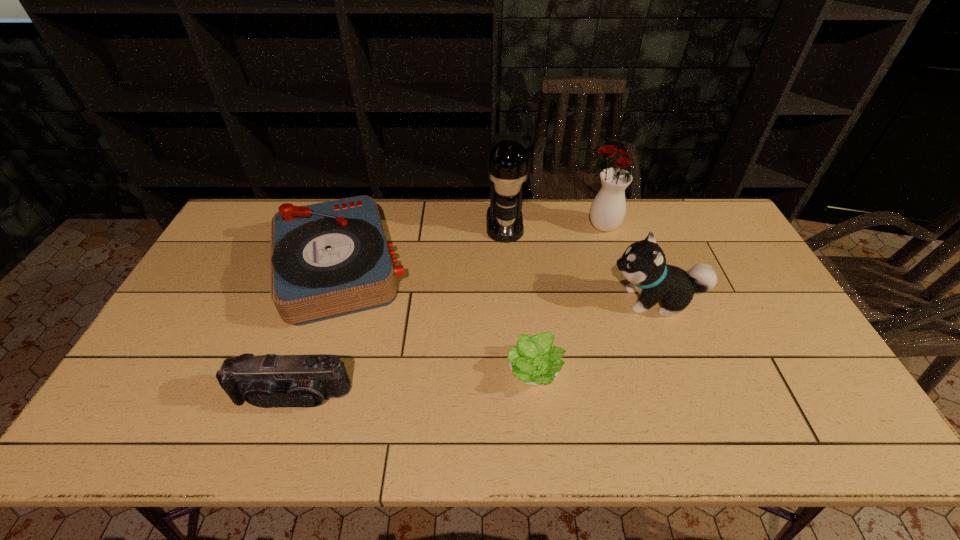
Find the location of a particular element. This screenshot has width=960, height=540. coffee maker is located at coordinates (508, 161).

The height and width of the screenshot is (540, 960). I want to click on vase, so click(x=608, y=208).

Find the location of `puppy`. puppy is located at coordinates (643, 263).

At what (x,y) coordinates should I click in order to perform the action: click on record player. Please return your answer as a coordinate pair (x, y). The width and height of the screenshot is (960, 540). Looking at the image, I should click on (331, 259).

I want to click on camcorder, so click(x=266, y=381).

Where is `lettuce`? lettuce is located at coordinates (534, 361).

At what (x,y) coordinates should I click in order to perform the action: click on vacant space located place cup under the spout of the coffee maker. Please return your answer as a coordinate pair (x, y). The image size is (960, 540). Looking at the image, I should click on pyautogui.click(x=509, y=295).

The height and width of the screenshot is (540, 960). What are the coordinates of `free space located 0.100m on the front of the vase` in the screenshot? It's located at (612, 258).

Where is `free spot located 0.130m at the face of the fourth shortest object`? The width and height of the screenshot is (960, 540). free spot located 0.130m at the face of the fourth shortest object is located at coordinates (562, 300).

Find the location of a particular element. The image size is (960, 540). vacant region located 0.060m at the face of the fourth shortest object is located at coordinates (586, 300).